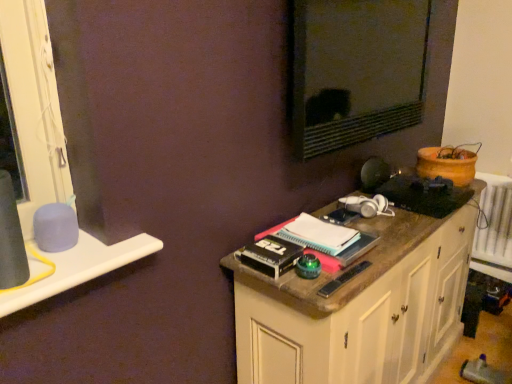
Locate an element on the screen. This screenshot has width=512, height=384. empty space that is ontop of white plastic window sill at left (from a real-world perspective) is located at coordinates tap(77, 255).